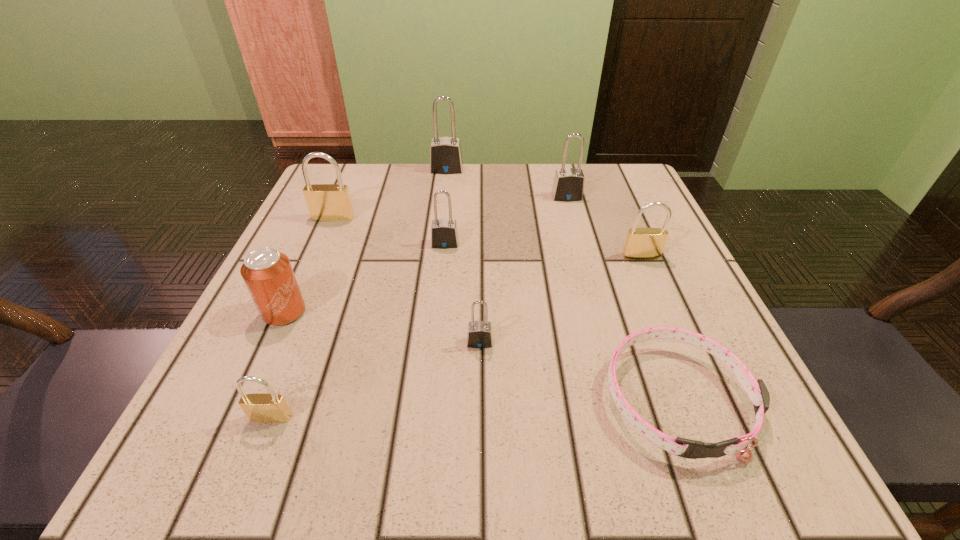
This screenshot has width=960, height=540. What are the coordinates of `free space that is in between the pink dog collar and the fifth padlock from left to right` in the screenshot? It's located at (578, 371).

Image resolution: width=960 pixels, height=540 pixels. In order to click on vacant area between the dog collar and the smallest brass padlock in this screenshot , I will do `click(474, 409)`.

You are a GUI agent. You are given a task and a screenshot of the screen. Output one action in this format:
    pyautogui.click(x=<x>, y=<y>)
    Task: Click on the vacant area between the third farthest object and the orange can
    Image resolution: width=960 pixels, height=540 pixels.
    Given the screenshot: What is the action you would take?
    pyautogui.click(x=309, y=265)

Find the location of a particular element. The image size is (960, 540). free space between the sixth padlock from left to right and the farthest gray padlock is located at coordinates (507, 183).

In order to click on empty location between the dog collar and the farthest gray padlock in this screenshot , I will do `click(562, 285)`.

Where is `vacant area that lies between the pink dog collar and the nearest gray padlock`? vacant area that lies between the pink dog collar and the nearest gray padlock is located at coordinates (578, 371).

Find the location of a particular element. free space between the fourth farthest object and the nearest brass padlock is located at coordinates (358, 330).

Image resolution: width=960 pixels, height=540 pixels. I want to click on vacant area that lies between the can and the second biggest brass padlock, so click(463, 284).

At what (x,y) coordinates should I click in order to perform the action: click on the closest object relative to the dog collar. Please return your answer as a coordinate pair (x, y). Looking at the image, I should click on (479, 334).

Find the location of a particular element. Image resolution: width=960 pixels, height=540 pixels. object that is the third closest to the orange can is located at coordinates (444, 234).